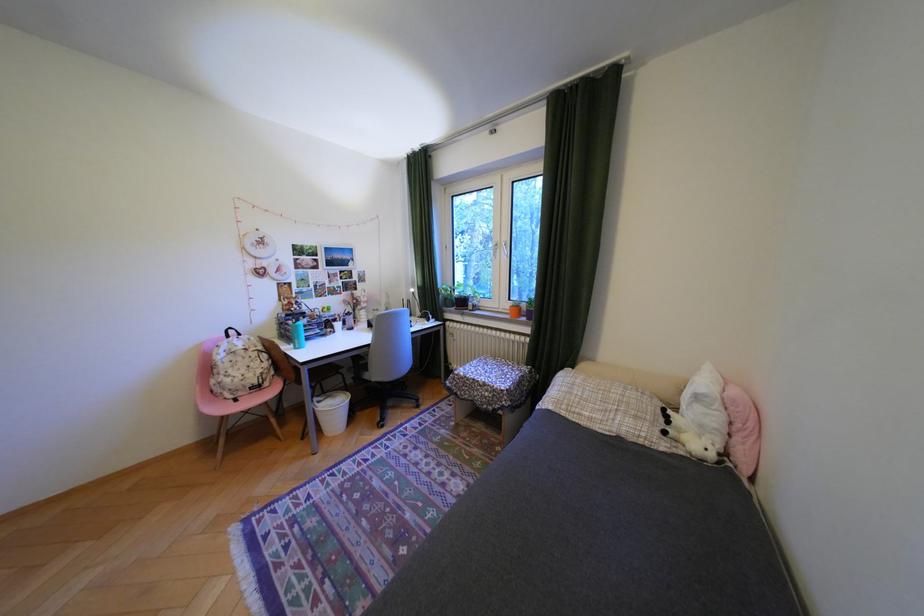
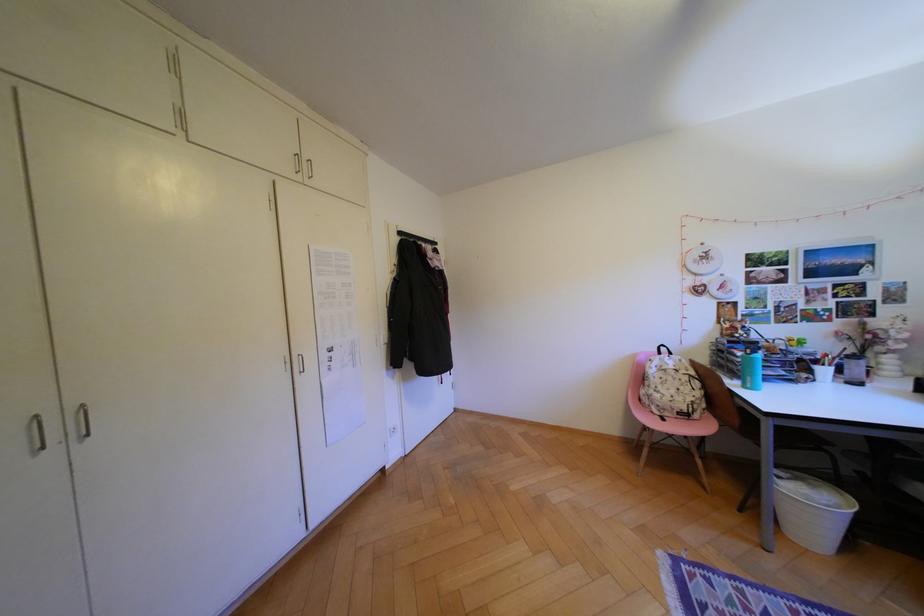
Question: The first image is from the beginning of the video and the second image is from the end. How did the camera likely rotate when shooting the video?

Choices:
 (A) Left
 (B) Right
 (C) Up
 (D) Down

Answer: (A)